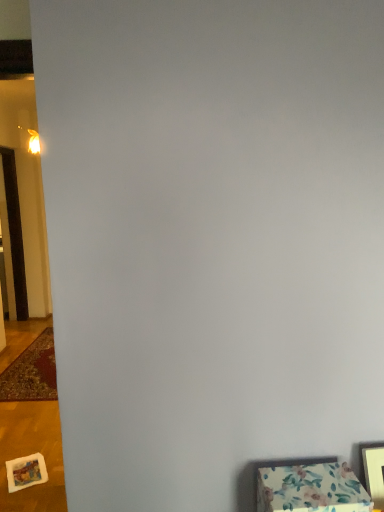
Locate an element on the screen. This screenshot has height=512, width=384. brown wooden door at left is located at coordinates (15, 232).

What do you see at coordinates (311, 489) in the screenshot? This screenshot has width=384, height=512. I see `floral fabric ottoman at lower right` at bounding box center [311, 489].

At what (x,y) coordinates should I click in order to perform the action: click on carpeted mat at left. Please return your answer as a coordinate pair (x, y). The height and width of the screenshot is (512, 384). Looking at the image, I should click on (32, 372).

Describe the element at coordinates (32, 372) in the screenshot. I see `carpeted mat at left` at that location.

This screenshot has height=512, width=384. I want to click on brown wooden door at left, so click(15, 232).

Looking at this image, does carpeted mat at left have a smaller size compared to floral fabric ottoman at lower right?

Incorrect, carpeted mat at left is not smaller in size than floral fabric ottoman at lower right.

From the image's perspective, is carpeted mat at left below floral fabric ottoman at lower right?

Indeed, from the image's perspective, carpeted mat at left is shown beneath floral fabric ottoman at lower right.

Considering the positions of objects carpeted mat at left and floral fabric ottoman at lower right in the image provided, who is more to the left, carpeted mat at left or floral fabric ottoman at lower right?

From the viewer's perspective, carpeted mat at left appears more on the left side.

You are a GUI agent. You are given a task and a screenshot of the screen. Output one action in this format:
    pyautogui.click(x=<x>, y=<y>)
    Task: Click on the door that appears above the carpeted mat at left (from the image's perspective)
    This screenshot has height=512, width=384.
    Given the screenshot: What is the action you would take?
    pyautogui.click(x=15, y=232)

Between brown wooden door at left and carpeted mat at left, which one has larger size?

Bigger between the two is brown wooden door at left.

Is carpeted mat at left completely or partially inside brown wooden door at left?

That's incorrect, carpeted mat at left is not inside brown wooden door at left.

From a real-world perspective, who is located higher, brown wooden door at left or carpeted mat at left?

In real-world perspective, brown wooden door at left is above.

Who is bigger, brown wooden door at left or wooden picture frame at lower right?

Bigger between the two is brown wooden door at left.

Find the location of a particular element. door that appears above the wooden picture frame at lower right (from a real-world perspective) is located at coordinates click(15, 232).

Measure the distance from brown wooden door at left to wooden picture frame at lower right.

They are 15.00 feet apart.

Between brown wooden door at left and wooden picture frame at lower right, which one is positioned behind?

brown wooden door at left is more distant.

Looking at this image, are wooden picture frame at lower right and carpeted mat at left located far from each other?

wooden picture frame at lower right is positioned a significant distance from carpeted mat at left.

How many degrees apart are the facing directions of wooden picture frame at lower right and carpeted mat at left?

There is a 1.85-degree angle between the facing directions of wooden picture frame at lower right and carpeted mat at left.

Which object is closer to the camera, wooden picture frame at lower right or carpeted mat at left?

wooden picture frame at lower right.

Is point (362, 454) farther from viewer compared to point (44, 383)?

No, it is not.

Can you confirm if floral fabric ottoman at lower right is positioned to the right of wooden picture frame at lower right?

In fact, floral fabric ottoman at lower right is to the left of wooden picture frame at lower right.

What's the angular difference between floral fabric ottoman at lower right and wooden picture frame at lower right's facing directions?

The facing directions of floral fabric ottoman at lower right and wooden picture frame at lower right are 0.00164 degrees apart.

Image resolution: width=384 pixels, height=512 pixels. Identify the location of furniture beneath the wooden picture frame at lower right (from a real-world perspective). (311, 489).

Which object is wider, floral fabric ottoman at lower right or wooden picture frame at lower right?

floral fabric ottoman at lower right.

Considering the positions of objects brown wooden door at left and floral fabric ottoman at lower right in the image provided, who is more to the right, brown wooden door at left or floral fabric ottoman at lower right?

From the viewer's perspective, floral fabric ottoman at lower right appears more on the right side.

Between brown wooden door at left and floral fabric ottoman at lower right, which one is positioned behind?

brown wooden door at left is further from the camera.

Who is taller, brown wooden door at left or floral fabric ottoman at lower right?

Standing taller between the two is brown wooden door at left.

Between carpeted mat at left and wooden picture frame at lower right, which one has smaller size?

Smaller between the two is wooden picture frame at lower right.

Does point (48, 355) appear closer or farther from the camera than point (363, 457)?

Point (48, 355) is farther from the camera than point (363, 457).

Measure the distance between carpeted mat at left and wooden picture frame at lower right.

carpeted mat at left and wooden picture frame at lower right are 3.09 meters apart from each other.

Would you consider carpeted mat at left to be distant from wooden picture frame at lower right?

Yes, carpeted mat at left and wooden picture frame at lower right are located far from each other.

Find the location of `furniture on the right of carpeted mat at left`. furniture on the right of carpeted mat at left is located at coordinates (311, 489).

The height and width of the screenshot is (512, 384). In the image, there is a carpeted mat at left. What are the coordinates of `door above it (from the image's perspective)` in the screenshot? It's located at (15, 232).

From the image, which object appears to be farther from floral fabric ottoman at lower right, wooden picture frame at lower right or brown wooden door at left?

brown wooden door at left is positioned further to the anchor floral fabric ottoman at lower right.

Considering their positions, is carpeted mat at left positioned closer to floral fabric ottoman at lower right than brown wooden door at left?

carpeted mat at left is closer to floral fabric ottoman at lower right.

Which object lies nearer to the anchor point carpeted mat at left, brown wooden door at left or wooden picture frame at lower right?

brown wooden door at left is positioned closer to the anchor carpeted mat at left.

Based on their spatial positions, is carpeted mat at left or floral fabric ottoman at lower right closer to brown wooden door at left?

Based on the image, carpeted mat at left appears to be nearer to brown wooden door at left.

Estimate the real-world distances between objects in this image. Which object is closer to carpeted mat at left, wooden picture frame at lower right or floral fabric ottoman at lower right?

The object closer to carpeted mat at left is floral fabric ottoman at lower right.

When comparing their distances from wooden picture frame at lower right, does brown wooden door at left or floral fabric ottoman at lower right seem further?

brown wooden door at left.

From the image, which object appears to be nearer to brown wooden door at left, floral fabric ottoman at lower right or carpeted mat at left?

carpeted mat at left.

In the scene shown: Based on their spatial positions, is wooden picture frame at lower right or brown wooden door at left further from carpeted mat at left?

Among the two, wooden picture frame at lower right is located further to carpeted mat at left.

Find the location of a particular element. This screenshot has height=512, width=384. picture frame between floral fabric ottoman at lower right and brown wooden door at left in the front-back direction is located at coordinates (374, 474).

Where is `mat located between floral fabric ottoman at lower right and brown wooden door at left in the depth direction`? The height and width of the screenshot is (512, 384). mat located between floral fabric ottoman at lower right and brown wooden door at left in the depth direction is located at coordinates (32, 372).

This screenshot has width=384, height=512. I want to click on mat positioned between wooden picture frame at lower right and brown wooden door at left from near to far, so click(32, 372).

Locate an element on the screen. picture frame between floral fabric ottoman at lower right and carpeted mat at left along the z-axis is located at coordinates (374, 474).